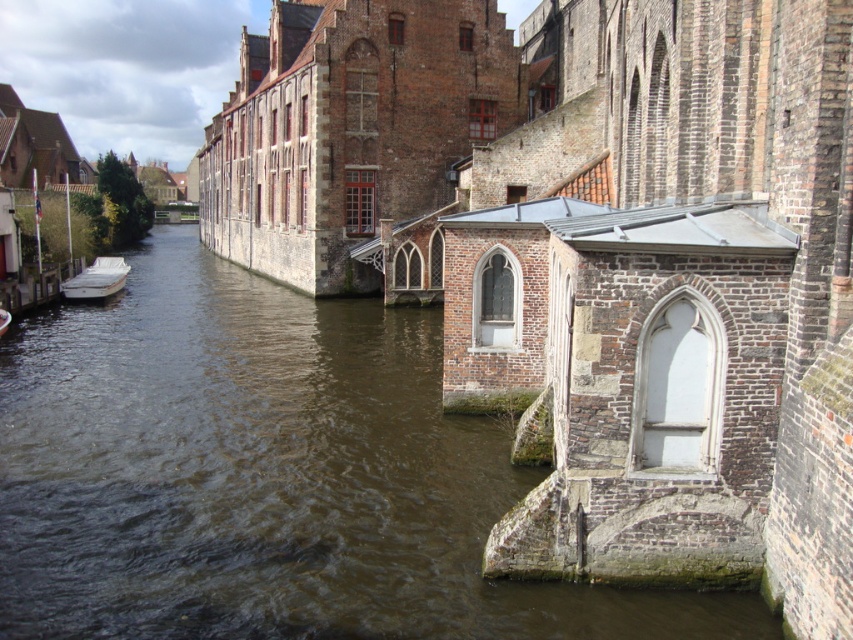
Based on the photo, you are a tourist standing on the canal bridge. You want to take a photo of the brown water at center and the white matte boat at left. Which object will appear larger in your photo?

The brown water at center will appear larger in the photo because it is closer to the viewer than the white matte boat at left.